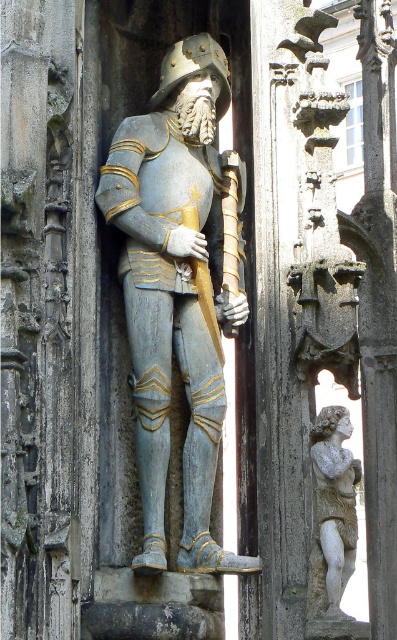
Question: Which point is closer to the camera?

Choices:
 (A) (316, 461)
 (B) (161, 451)

Answer: (A)

Question: Does matte blue armor at center appear over carved stone cherub at right?

Choices:
 (A) yes
 (B) no

Answer: (A)

Question: Where is matte blue armor at center located in relation to carved stone cherub at right in the image?

Choices:
 (A) below
 (B) above

Answer: (B)

Question: Does matte blue armor at center come behind carved stone cherub at right?

Choices:
 (A) yes
 (B) no

Answer: (A)

Question: Which point is closer to the camera?

Choices:
 (A) carved stone cherub at right
 (B) matte blue armor at center

Answer: (A)